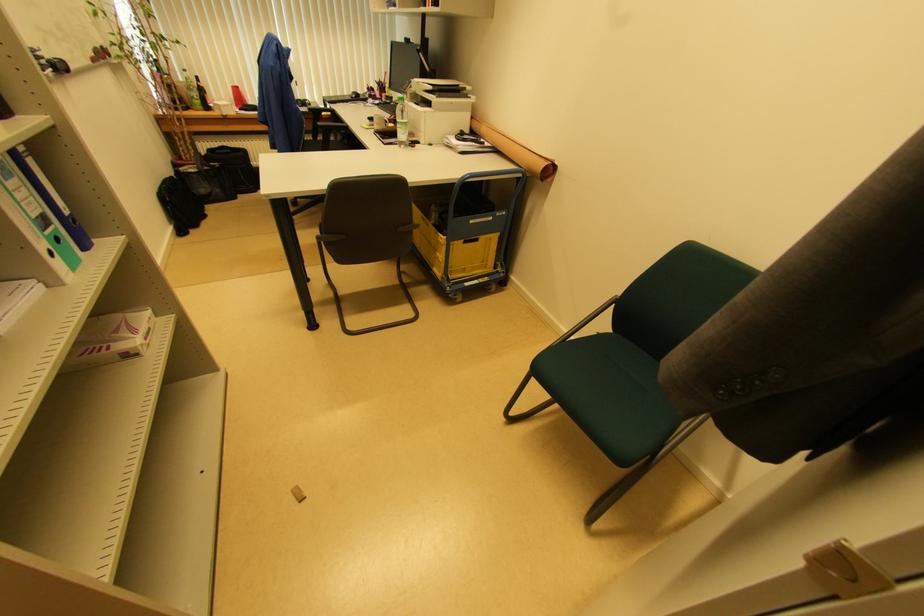
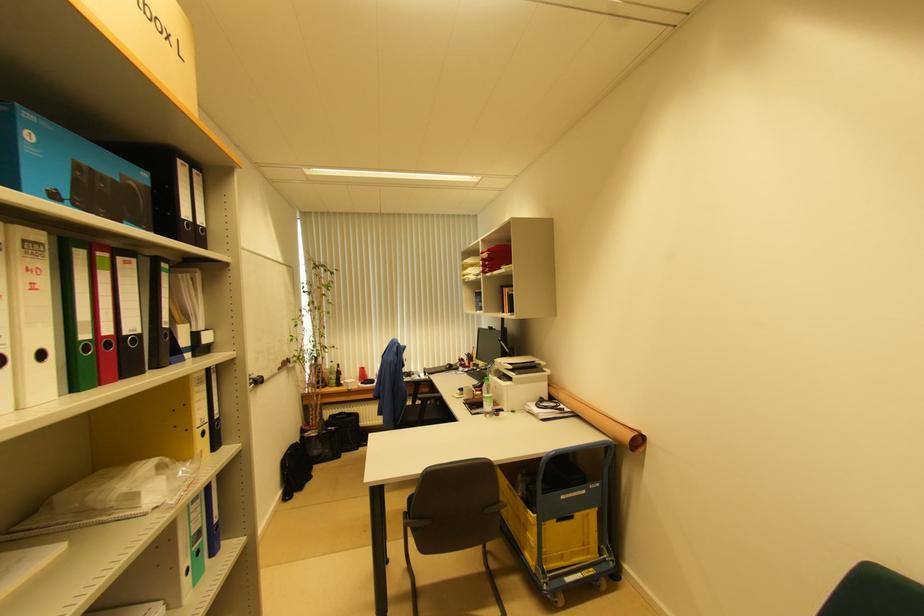
The images are taken continuously from a first-person perspective. In which direction is your viewpoint rotating?

The camera rotated toward left-up.